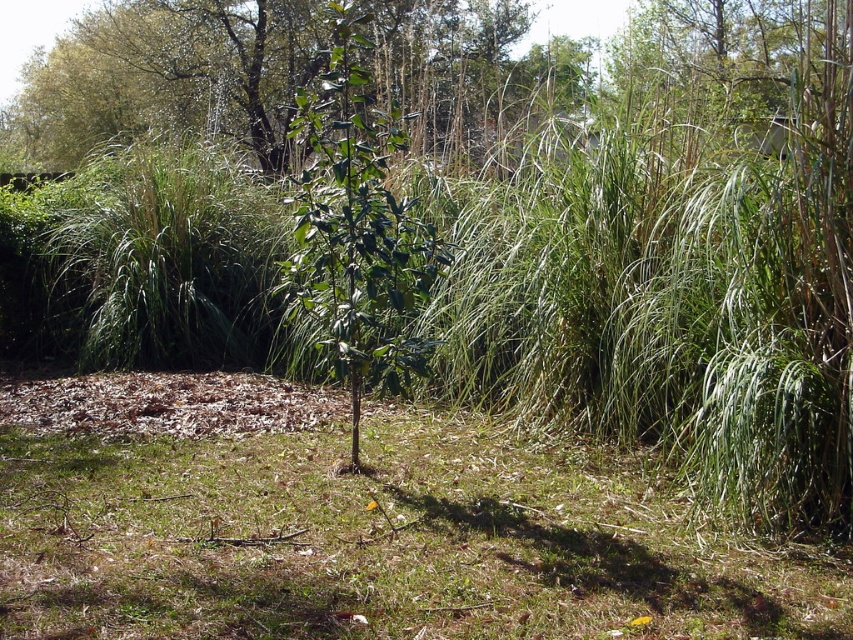
You are a gardener who wants to plant a new flower between the green grass at center and the green glossy leafy plant at center. Based on their positions, where should you place the flower?

The green grass at center is positioned under the green glossy leafy plant at center, so you should plant the flower between them where there is space.

You are standing in the garden looking at the green grass at center and the green leafy plant at upper center. Which object is closer to the ground?

The green grass at center is closer to the ground as it is positioned under the green leafy plant at upper center.